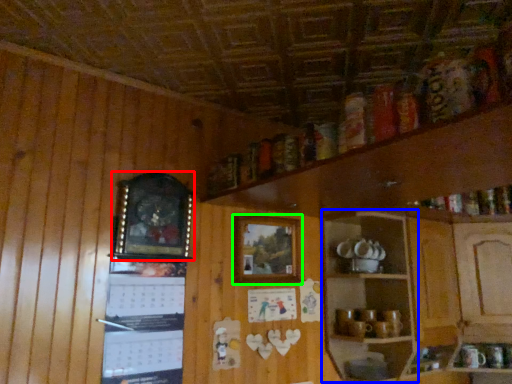
Question: Which is nearer to the picture frame (highlighted by a red box)? shelf (highlighted by a blue box) or picture frame (highlighted by a green box).

Choices:
 (A) shelf
 (B) picture frame

Answer: (B)